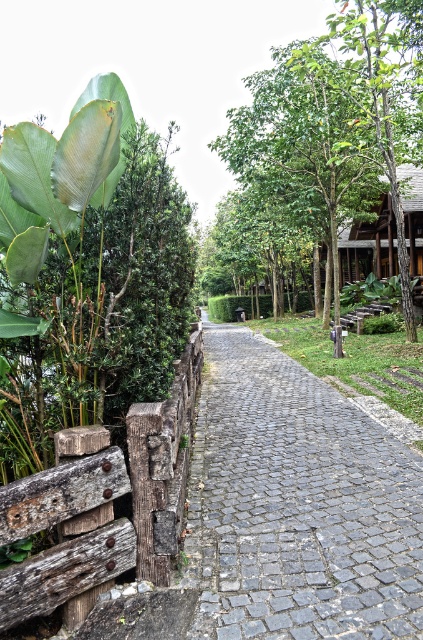
Which of these two, gray cobblestone pavement at center or green leafy tree at upper center, stands shorter?

gray cobblestone pavement at center

Is point (294, 362) less distant than point (225, 154)?

Yes, it is.

Where is `gray cobblestone pavement at center`? Image resolution: width=423 pixels, height=640 pixels. gray cobblestone pavement at center is located at coordinates (296, 506).

Does point (299, 156) come closer to viewer compared to point (419, 224)?

That is True.

Between green leafy tree at upper center and wooden hut at right, which one has more height?

green leafy tree at upper center

This screenshot has width=423, height=640. In order to click on green leafy tree at upper center in this screenshot , I will do `click(338, 112)`.

Where is `green leafy tree at upper center`? This screenshot has width=423, height=640. green leafy tree at upper center is located at coordinates (338, 112).

The height and width of the screenshot is (640, 423). What are the coordinates of `gray cobblestone pavement at center` in the screenshot? It's located at (296, 506).

Is gray cobblestone pavement at center positioned before wooden park bench at center?

Yes, it is.

The height and width of the screenshot is (640, 423). I want to click on gray cobblestone pavement at center, so click(x=296, y=506).